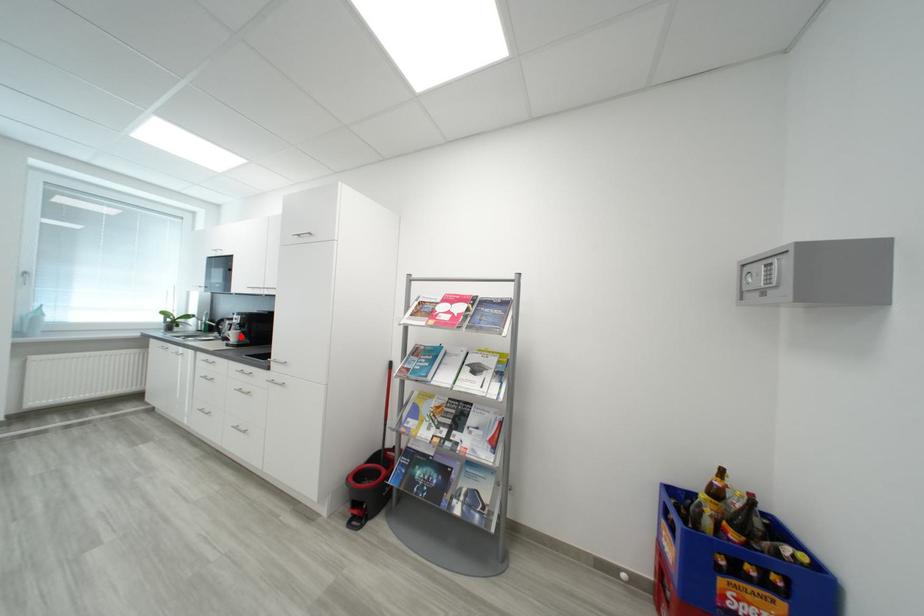
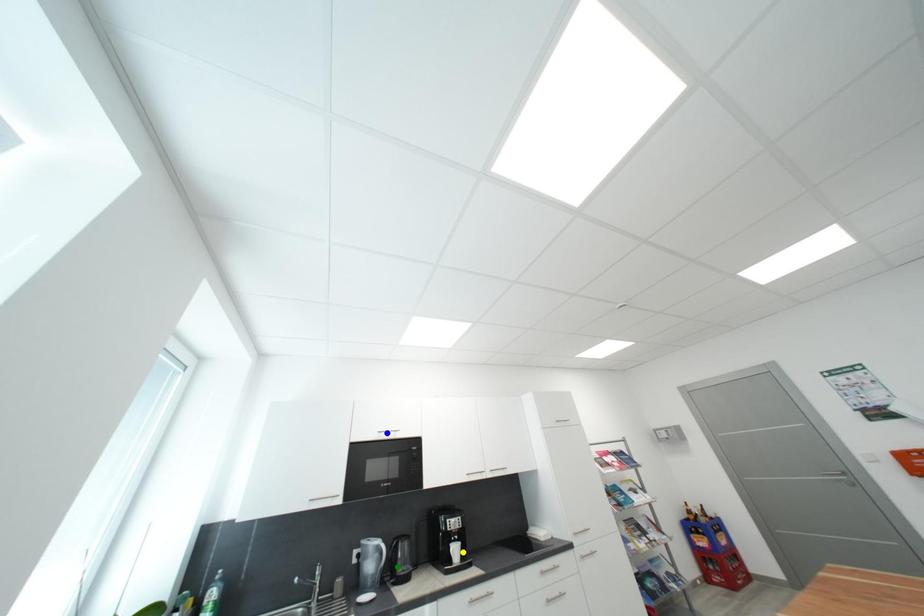
Question: I am providing you with two images of the same scene from different viewpoints. A red point is marked on the first image. You are given multiple points on the second image. Which point in image 2 represents the same 3d spot as the red point in image 1?

Choices:
 (A) blue point
 (B) green point
 (C) yellow point

Answer: (C)